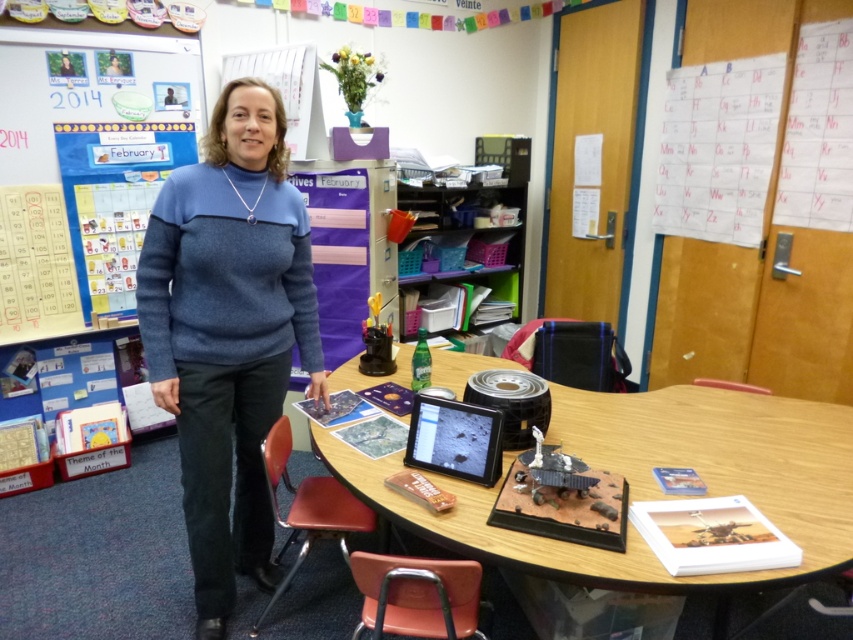
Which is above, wooden table at center or whiteboard at upper left?

whiteboard at upper left is higher up.

Between point (701, 464) and point (28, 324), which one is positioned behind?

The point (28, 324) is more distant.

Identify the location of wooden table at center. (653, 483).

Is blue wool sweater at center to the left of wooden table at center from the viewer's perspective?

Correct, you'll find blue wool sweater at center to the left of wooden table at center.

Is blue wool sweater at center positioned at the back of wooden table at center?

Yes, it is behind wooden table at center.

Image resolution: width=853 pixels, height=640 pixels. Describe the element at coordinates (228, 332) in the screenshot. I see `blue wool sweater at center` at that location.

Locate an element on the screen. The height and width of the screenshot is (640, 853). blue wool sweater at center is located at coordinates (228, 332).

Can you confirm if blue wool sweater at center is thinner than whiteboard at upper left?

Correct, blue wool sweater at center's width is less than whiteboard at upper left's.

Does blue wool sweater at center have a smaller size compared to whiteboard at upper left?

Indeed, blue wool sweater at center has a smaller size compared to whiteboard at upper left.

Which is in front, point (206, 467) or point (74, 81)?

Point (206, 467) is more forward.

You are a GUI agent. You are given a task and a screenshot of the screen. Output one action in this format:
    pyautogui.click(x=<x>, y=<y>)
    Task: Click on the blue wool sweater at center
    Image resolution: width=853 pixels, height=640 pixels.
    Given the screenshot: What is the action you would take?
    pyautogui.click(x=228, y=332)